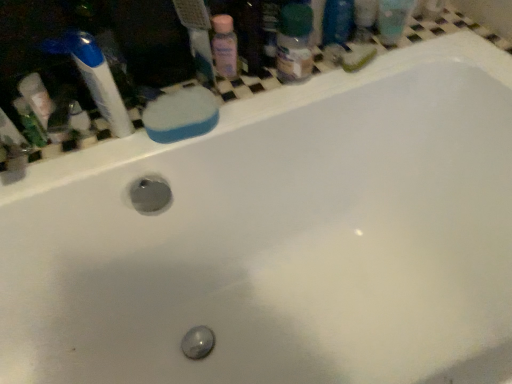
You are a GUI agent. You are given a task and a screenshot of the screen. Output one action in this format:
    pyautogui.click(x=<x>, y=<y>)
    Task: Click on the blue sponge at upper left
    This screenshot has width=512, height=384.
    Given the screenshot: What is the action you would take?
    point(181,115)

Measure the distance between blue plastic toothbrush at upper left and camera.

The depth of blue plastic toothbrush at upper left is 27.87 inches.

At what (x,y) coordinates should I click in order to perform the action: click on blue sponge at upper left. Please return your answer as a coordinate pair (x, y). The image size is (512, 384). Looking at the image, I should click on (181, 115).

Based on the photo, can you tell me how much green matte bottle at left and blue plastic toothbrush at upper left differ in facing direction?

72.8 degrees.

Is green matte bottle at left at the left side of blue plastic toothbrush at upper left?

Yes, green matte bottle at left is to the left of blue plastic toothbrush at upper left.

Which object is thinner, green matte bottle at left or blue plastic toothbrush at upper left?

blue plastic toothbrush at upper left.

Is green matte bottle at left facing towards blue plastic toothbrush at upper left?

No, green matte bottle at left is not oriented towards blue plastic toothbrush at upper left.

Relative to pink plastic bottle at upper center, is blue plastic toothbrush at upper left in front or behind?

Clearly, blue plastic toothbrush at upper left is in front of pink plastic bottle at upper center.

Which object is thinner, blue plastic toothbrush at upper left or pink plastic bottle at upper center?

With smaller width is pink plastic bottle at upper center.

What's the angular difference between blue plastic toothbrush at upper left and pink plastic bottle at upper center's facing directions?

A: The facing directions of blue plastic toothbrush at upper left and pink plastic bottle at upper center are 72.8 degrees apart.

Considering the relative sizes of blue plastic toothbrush at upper left and pink plastic bottle at upper center in the image provided, is blue plastic toothbrush at upper left smaller than pink plastic bottle at upper center?

Incorrect, blue plastic toothbrush at upper left is not smaller in size than pink plastic bottle at upper center.

How many degrees apart are the facing directions of blue plastic toothbrush at upper left and green matte bottle at left?

The angular difference between blue plastic toothbrush at upper left and green matte bottle at left is 72.8 degrees.

From the image's perspective, which one is positioned lower, blue plastic toothbrush at upper left or green matte bottle at left?

green matte bottle at left.

Is blue plastic toothbrush at upper left wider than green matte bottle at left?

No, blue plastic toothbrush at upper left is not wider than green matte bottle at left.

Consider the image. Considering the relative sizes of blue plastic toothbrush at upper left and green matte bottle at left in the image provided, is blue plastic toothbrush at upper left smaller than green matte bottle at left?

No, blue plastic toothbrush at upper left is not smaller than green matte bottle at left.

Considering the relative positions of blue sponge at upper left and blue plastic toothbrush at upper left in the image provided, is blue sponge at upper left to the left or to the right of blue plastic toothbrush at upper left?

From the image, it's evident that blue sponge at upper left is to the right of blue plastic toothbrush at upper left.

Based on their sizes in the image, would you say blue sponge at upper left is bigger or smaller than blue plastic toothbrush at upper left?

blue sponge at upper left is smaller than blue plastic toothbrush at upper left.

Considering the positions of objects translucent plastic bottle at upper right and blue plastic toothbrush at upper left in the image provided, who is more to the right, translucent plastic bottle at upper right or blue plastic toothbrush at upper left?

translucent plastic bottle at upper right is more to the right.

Between point (303, 80) and point (112, 110), which one is positioned in front?

Point (112, 110)

From the image's perspective, which one is positioned higher, translucent plastic bottle at upper right or blue plastic toothbrush at upper left?

translucent plastic bottle at upper right is shown above in the image.

From a real-world perspective, is translucent plastic bottle at upper right physically above blue plastic toothbrush at upper left?

No, from a real-world perspective, translucent plastic bottle at upper right is not over blue plastic toothbrush at upper left

Does point (161, 129) come behind point (41, 141)?

No, it is in front of (41, 141).

From the image's perspective, which object appears higher, blue sponge at upper left or green matte bottle at left?

blue sponge at upper left, from the image's perspective.

Which object is closer to the camera taking this photo, blue sponge at upper left or green matte bottle at left?

green matte bottle at left is closer to the camera.

Locate an element on the screen. mouthwash lying on the left of blue sponge at upper left is located at coordinates (30, 123).

Is translucent plastic bottle at upper right in contact with green matte bottle at left?

No, translucent plastic bottle at upper right is not making contact with green matte bottle at left.

Does point (297, 7) come closer to viewer compared to point (45, 143)?

Yes.

Considering the positions of objects translucent plastic bottle at upper right and green matte bottle at left in the image provided, who is behind, translucent plastic bottle at upper right or green matte bottle at left?

translucent plastic bottle at upper right is further away from the camera.

Identify the location of toiletry to the right of green matte bottle at left. The width and height of the screenshot is (512, 384). (294, 43).

Locate an element on the screen. The height and width of the screenshot is (384, 512). mouthwash below the blue plastic toothbrush at upper left (from a real-world perspective) is located at coordinates point(30,123).

The width and height of the screenshot is (512, 384). I want to click on cleaning product located on the right of blue plastic toothbrush at upper left, so click(x=225, y=46).

Looking at the image, which one is located further to translucent plastic bottle at upper right, blue plastic toothbrush at upper left or green matte bottle at left?

green matte bottle at left is further to translucent plastic bottle at upper right.

Based on their spatial positions, is translucent plastic bottle at upper right or blue sponge at upper left further from green matte bottle at left?

The object further to green matte bottle at left is translucent plastic bottle at upper right.

Consider the image. Which object lies further to the anchor point green matte bottle at left, pink plastic bottle at upper center or translucent plastic bottle at upper right?

Among the two, translucent plastic bottle at upper right is located further to green matte bottle at left.

Considering their positions, is blue plastic toothbrush at upper left positioned further to green matte bottle at left than blue sponge at upper left?

The object further to green matte bottle at left is blue sponge at upper left.

Which object lies further to the anchor point blue plastic toothbrush at upper left, blue sponge at upper left or green matte bottle at left?

green matte bottle at left.

Based on their spatial positions, is green matte bottle at left or blue plastic toothbrush at upper left closer to translucent plastic bottle at upper right?

blue plastic toothbrush at upper left is positioned closer to the anchor translucent plastic bottle at upper right.

Considering their positions, is pink plastic bottle at upper center positioned closer to green matte bottle at left than blue sponge at upper left?

blue sponge at upper left is positioned closer to the anchor green matte bottle at left.

Looking at the image, which one is located closer to green matte bottle at left, translucent plastic bottle at upper right or blue plastic toothbrush at upper left?

Among the two, blue plastic toothbrush at upper left is located nearer to green matte bottle at left.

I want to click on soap between blue plastic toothbrush at upper left and pink plastic bottle at upper center in the horizontal direction, so click(x=181, y=115).

Where is `toothbrush between green matte bottle at left and translucent plastic bottle at upper right from left to right`? This screenshot has width=512, height=384. toothbrush between green matte bottle at left and translucent plastic bottle at upper right from left to right is located at coordinates (94, 77).

At what (x,y) coordinates should I click in order to perform the action: click on soap between green matte bottle at left and pink plastic bottle at upper center. Please return your answer as a coordinate pair (x, y). Image resolution: width=512 pixels, height=384 pixels. Looking at the image, I should click on (181, 115).

Locate an element on the screen. This screenshot has width=512, height=384. soap between green matte bottle at left and translucent plastic bottle at upper right in the horizontal direction is located at coordinates (181, 115).